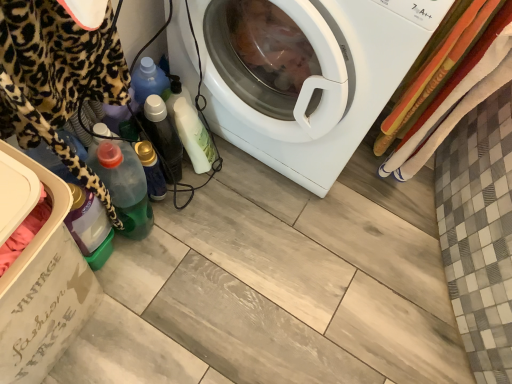
The height and width of the screenshot is (384, 512). What are the coordinates of `multicolored woven blanket at right` in the screenshot? It's located at (457, 98).

I want to click on transparent plastic dish washer at lower left, so click(x=39, y=274).

From a real-world perspective, which object rests below the other?

From a 3D spatial view, translucent plastic bottle at center, marked as the second bottle in a bottom-to-top arrangement, is below.

Does translucent plastic bottle at center, the second bottle in the top-to-bottom sequence, touch white glossy washing machine at center?

No, translucent plastic bottle at center, the second bottle in the top-to-bottom sequence, is not making contact with white glossy washing machine at center.

Based on the photo, which object is positioned more to the left, translucent plastic bottle at center, the second bottle in the top-to-bottom sequence, or white glossy washing machine at center?

translucent plastic bottle at center, the second bottle in the top-to-bottom sequence.

From a real-world perspective, is transparent plastic dish washer at lower left positioned above or below translucent plastic bottle at center, marked as the second bottle in a bottom-to-top arrangement?

Clearly, from a real-world perspective, transparent plastic dish washer at lower left is above translucent plastic bottle at center, marked as the second bottle in a bottom-to-top arrangement.

The image size is (512, 384). Find the location of `bottle that is the 2nd object to the right of the transparent plastic dish washer at lower left, starting at the anchor`. bottle that is the 2nd object to the right of the transparent plastic dish washer at lower left, starting at the anchor is located at coordinates (151, 170).

Between transparent plastic dish washer at lower left and translucent plastic bottle at center, marked as the second bottle in a bottom-to-top arrangement, which one appears on the right side from the viewer's perspective?

From the viewer's perspective, translucent plastic bottle at center, marked as the second bottle in a bottom-to-top arrangement, appears more on the right side.

Which object is closer to the camera taking this photo, transparent plastic dish washer at lower left or translucent plastic bottle at center, marked as the second bottle in a bottom-to-top arrangement?

Positioned in front is transparent plastic dish washer at lower left.

How distant is translucent plastic bottle at center, marked as the second bottle in a bottom-to-top arrangement, from transparent plastic dish washer at lower left?

translucent plastic bottle at center, marked as the second bottle in a bottom-to-top arrangement, is 16.83 inches away from transparent plastic dish washer at lower left.

Is translucent plastic bottle at center, the second bottle in the top-to-bottom sequence, bigger than transparent plastic dish washer at lower left?

No.

Is translucent plastic bottle at center, marked as the second bottle in a bottom-to-top arrangement, wider than transparent plastic dish washer at lower left?

In fact, translucent plastic bottle at center, marked as the second bottle in a bottom-to-top arrangement, might be narrower than transparent plastic dish washer at lower left.

Can you tell me how much translucent plastic bottle at center, marked as the second bottle in a bottom-to-top arrangement, and transparent plastic dish washer at lower left differ in facing direction?

The angle between the facing direction of translucent plastic bottle at center, marked as the second bottle in a bottom-to-top arrangement, and the facing direction of transparent plastic dish washer at lower left is 72.1 degrees.

Which is closer, (156, 183) or (181, 149)?

Point (156, 183) is positioned closer to the camera compared to point (181, 149).

This screenshot has width=512, height=384. I want to click on the 1st bottle in front of the translucent plastic bottle at center, marked as the second bottle in a bottom-to-top arrangement, so click(x=163, y=136).

Are translucent plastic bottle at center, the second bottle in the top-to-bottom sequence, and white glossy bottle at center, which appears as the third bottle when ordered from the bottom, beside each other?

Yes, translucent plastic bottle at center, the second bottle in the top-to-bottom sequence, is with white glossy bottle at center, which appears as the third bottle when ordered from the bottom.

Is white glossy bottle at center, placed as the 1th bottle when sorted from top to bottom, bigger than translucent plastic bottle at center, the second bottle in the top-to-bottom sequence?

Correct, white glossy bottle at center, placed as the 1th bottle when sorted from top to bottom, is larger in size than translucent plastic bottle at center, the second bottle in the top-to-bottom sequence.

In order to click on bottle above the translucent plastic bottle at center, marked as the second bottle in a bottom-to-top arrangement (from the image's perspective) in this screenshot , I will do `click(163, 136)`.

From their relative heights in the image, would you say white glossy bottle at center, which appears as the third bottle when ordered from the bottom, is taller or shorter than translucent plastic bottle at center, the second bottle in the top-to-bottom sequence?

In the image, white glossy bottle at center, which appears as the third bottle when ordered from the bottom, appears to be taller than translucent plastic bottle at center, the second bottle in the top-to-bottom sequence.

From a real-world perspective, is white glossy bottle at center, placed as the 1th bottle when sorted from top to bottom, positioned under translucent plastic bottle at center, the second bottle in the top-to-bottom sequence, based on gravity?

No.

Are multicolored woven blanket at right and translucent plastic bottle at center, the second bottle in the top-to-bottom sequence, far apart?

Actually, multicolored woven blanket at right and translucent plastic bottle at center, the second bottle in the top-to-bottom sequence, are a little close together.

Which is in front, point (449, 132) or point (157, 191)?

The point (449, 132) is closer to the camera.

Is multicolored woven blanket at right wider than translucent plastic bottle at center, marked as the second bottle in a bottom-to-top arrangement?

Incorrect, the width of multicolored woven blanket at right does not surpass that of translucent plastic bottle at center, marked as the second bottle in a bottom-to-top arrangement.

How much distance is there between multicolored woven blanket at right and translucent plastic bottle at center, the second bottle in the top-to-bottom sequence?

The distance of multicolored woven blanket at right from translucent plastic bottle at center, the second bottle in the top-to-bottom sequence, is 29.38 inches.

Which object is further away from the camera, white glossy washing machine at center or translucent plastic bottle at center, marked as the second bottle in a bottom-to-top arrangement?

translucent plastic bottle at center, marked as the second bottle in a bottom-to-top arrangement, is more distant.

From the image's perspective, which object appears higher, white glossy washing machine at center or translucent plastic bottle at center, the second bottle in the top-to-bottom sequence?

white glossy washing machine at center.

How many degrees apart are the facing directions of white glossy washing machine at center and translucent plastic bottle at center, the second bottle in the top-to-bottom sequence?

The angular difference between white glossy washing machine at center and translucent plastic bottle at center, the second bottle in the top-to-bottom sequence, is 164 degrees.

Does white glossy washing machine at center have a larger size compared to translucent plastic bottle at center, the second bottle in the top-to-bottom sequence?

Indeed, white glossy washing machine at center has a larger size compared to translucent plastic bottle at center, the second bottle in the top-to-bottom sequence.

Starting from the white glossy washing machine at center, which bottle is the 2nd one to the left? Please provide its 2D coordinates.

[(151, 170)]

This screenshot has width=512, height=384. I want to click on bottle that is the 3rd one when counting backward from the transparent plastic dish washer at lower left, so click(x=151, y=170).

Which object lies nearer to the anchor point multicolored woven blanket at right, white glossy washing machine at center or white glossy bottle at center, which appears as the third bottle when ordered from the bottom?

The object closer to multicolored woven blanket at right is white glossy washing machine at center.

When comparing their distances from white glossy washing machine at center, does translucent plastic bottle at lower left, which is the first bottle in bottom-to-top order, or translucent plastic bottle at center, the second bottle in the top-to-bottom sequence, seem further?

translucent plastic bottle at lower left, which is the first bottle in bottom-to-top order, is positioned further to the anchor white glossy washing machine at center.

Which object lies nearer to the anchor point transparent plastic dish washer at lower left, translucent plastic bottle at center, the second bottle in the top-to-bottom sequence, or white glossy bottle at center, which appears as the third bottle when ordered from the bottom?

translucent plastic bottle at center, the second bottle in the top-to-bottom sequence, is closer to transparent plastic dish washer at lower left.

Which object lies nearer to the anchor point white glossy washing machine at center, transparent plastic dish washer at lower left or translucent plastic bottle at center, the second bottle in the top-to-bottom sequence?

translucent plastic bottle at center, the second bottle in the top-to-bottom sequence, is positioned closer to the anchor white glossy washing machine at center.

Considering their positions, is transparent plastic dish washer at lower left positioned further to white glossy washing machine at center than white glossy bottle at center, which appears as the third bottle when ordered from the bottom?

Based on the image, transparent plastic dish washer at lower left appears to be further to white glossy washing machine at center.

Estimate the real-world distances between objects in this image. Which object is further from translucent plastic bottle at center, the second bottle in the top-to-bottom sequence, transparent plastic dish washer at lower left or white glossy bottle at center, placed as the 1th bottle when sorted from top to bottom?

transparent plastic dish washer at lower left.

From the image, which object appears to be nearer to white glossy bottle at center, which appears as the third bottle when ordered from the bottom, translucent plastic bottle at lower left, which is the first bottle in bottom-to-top order, or translucent plastic bottle at center, the second bottle in the top-to-bottom sequence?

The object closer to white glossy bottle at center, which appears as the third bottle when ordered from the bottom, is translucent plastic bottle at center, the second bottle in the top-to-bottom sequence.

Based on their spatial positions, is multicolored woven blanket at right or translucent plastic bottle at lower left, which is the first bottle in bottom-to-top order, further from translucent plastic bottle at center, marked as the second bottle in a bottom-to-top arrangement?

multicolored woven blanket at right is further to translucent plastic bottle at center, marked as the second bottle in a bottom-to-top arrangement.

The image size is (512, 384). In order to click on washing machine located between translucent plastic bottle at lower left, arranged as the third bottle when viewed from the top, and multicolored woven blanket at right in the left-right direction in this screenshot , I will do `click(325, 83)`.

At what (x,y) coordinates should I click in order to perform the action: click on bottle located between translucent plastic bottle at lower left, which is the first bottle in bottom-to-top order, and translucent plastic bottle at center, marked as the second bottle in a bottom-to-top arrangement, in the depth direction. Please return your answer as a coordinate pair (x, y). This screenshot has height=384, width=512. Looking at the image, I should click on (163, 136).

At what (x,y) coordinates should I click in order to perform the action: click on washing machine situated between transparent plastic dish washer at lower left and multicolored woven blanket at right from left to right. Please return your answer as a coordinate pair (x, y). Looking at the image, I should click on (325, 83).

You are a GUI agent. You are given a task and a screenshot of the screen. Output one action in this format:
    pyautogui.click(x=<x>, y=<y>)
    Task: Click on the bottle between transparent plastic dish washer at lower left and white glossy bottle at center, placed as the 1th bottle when sorted from top to bottom, from front to back
    The height and width of the screenshot is (384, 512).
    Given the screenshot: What is the action you would take?
    pyautogui.click(x=124, y=186)